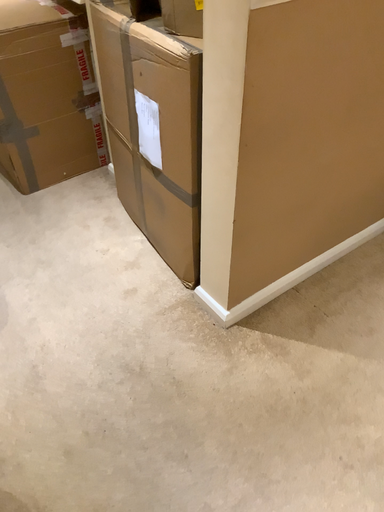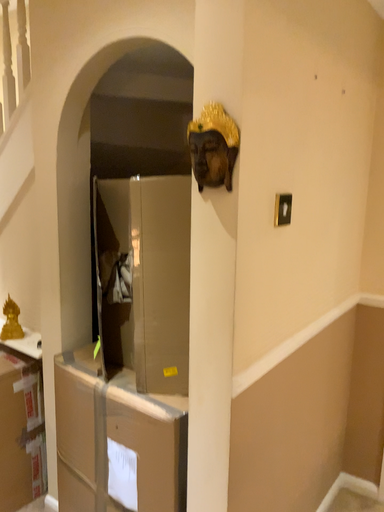
Question: How did the camera likely rotate when shooting the video?

Choices:
 (A) rotated right
 (B) rotated left

Answer: (A)